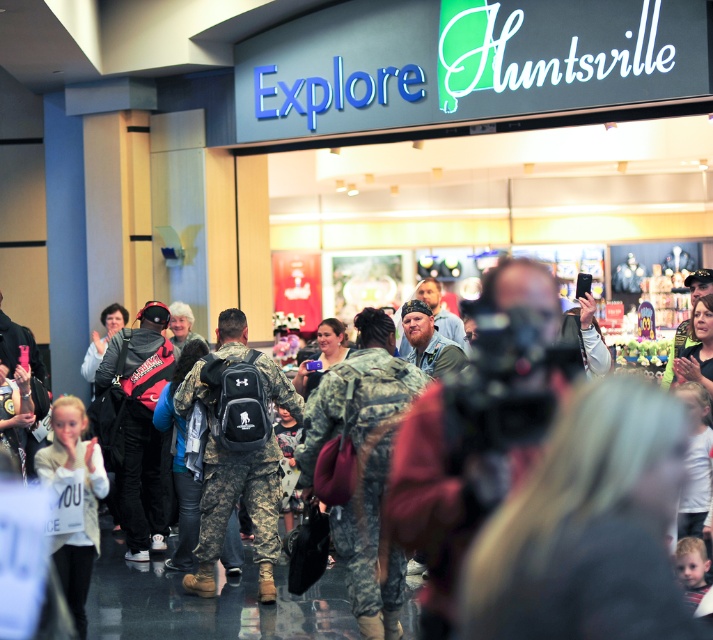
Question: Among these points, which one is farthest from the camera?

Choices:
 (A) (215, 339)
 (B) (46, 461)

Answer: (A)

Question: Does camouflage backpack at center have a lesser width compared to white cotton shirt at lower left?

Choices:
 (A) yes
 (B) no

Answer: (B)

Question: Is camouflage backpack at center to the right of white cotton shirt at lower left from the viewer's perspective?

Choices:
 (A) no
 (B) yes

Answer: (B)

Question: Can you confirm if camouflage backpack at center is positioned to the left of white cotton shirt at lower left?

Choices:
 (A) no
 (B) yes

Answer: (A)

Question: Which point is closer to the camera?

Choices:
 (A) white cotton shirt at lower left
 (B) camouflage backpack at center

Answer: (A)